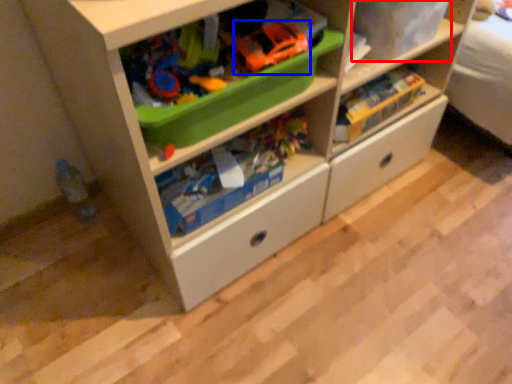
Question: Which point is further to the camera, storage box (highlighted by a red box) or toy car (highlighted by a blue box)?

Choices:
 (A) storage box
 (B) toy car

Answer: (A)